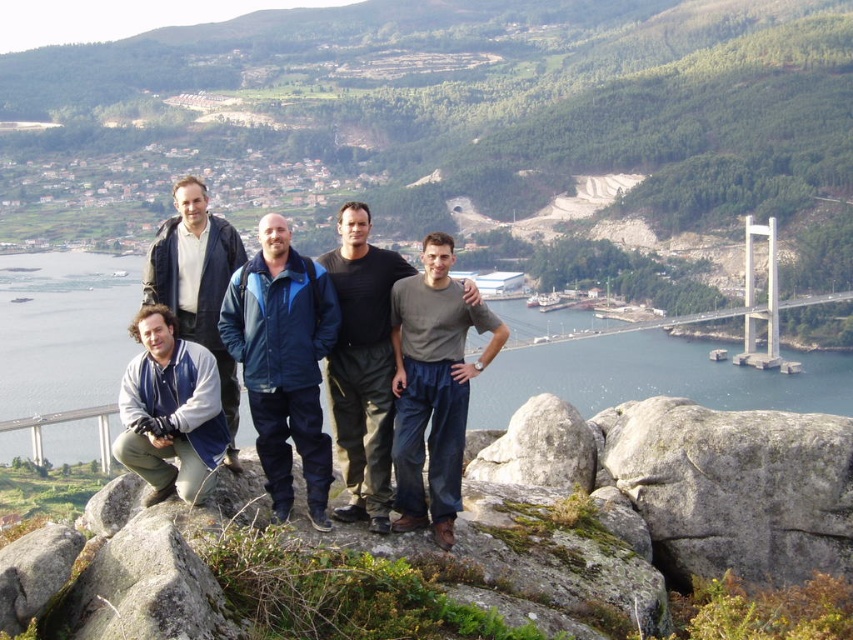
Between point (788, 406) and point (123, 392), which one is positioned behind?

Point (788, 406)

Is blue water at center above blue-gray jacket at lower left?

No.

This screenshot has width=853, height=640. What are the coordinates of `blue water at center` in the screenshot? It's located at (642, 371).

Identify the location of blue water at center. (642, 371).

Is point (395, 340) more distant than point (236, 429)?

Yes, point (395, 340) is behind point (236, 429).

Who is positioned more to the left, matte gray shirt at center or matte blue jacket at lower left?

matte blue jacket at lower left is more to the left.

Does point (492, 326) come behind point (206, 195)?

No, it is in front of (206, 195).

Identify the location of matte gray shirt at center. (433, 387).

Between blue water at center and gray rough rock at center, which one has less height?

gray rough rock at center

Locate an element on the screen. This screenshot has width=853, height=640. blue water at center is located at coordinates (642, 371).

This screenshot has width=853, height=640. Identify the location of blue water at center. (642, 371).